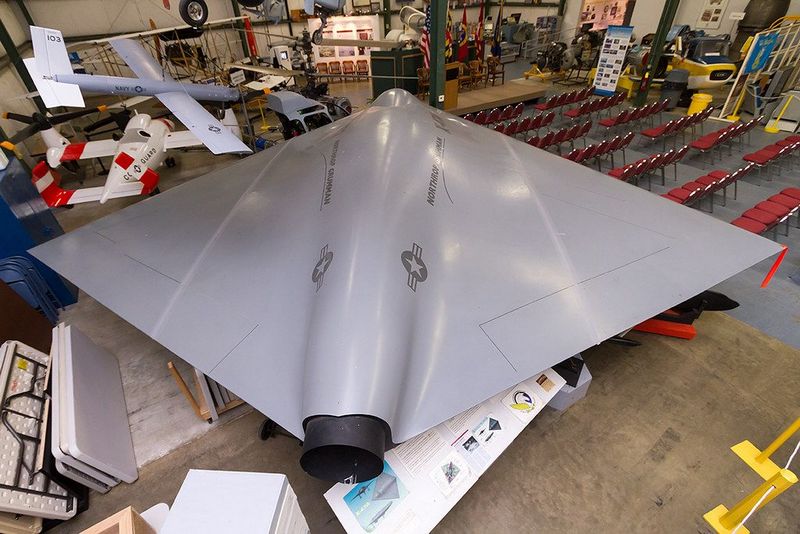
Locate an element on the screen. chair is located at coordinates (674, 193).